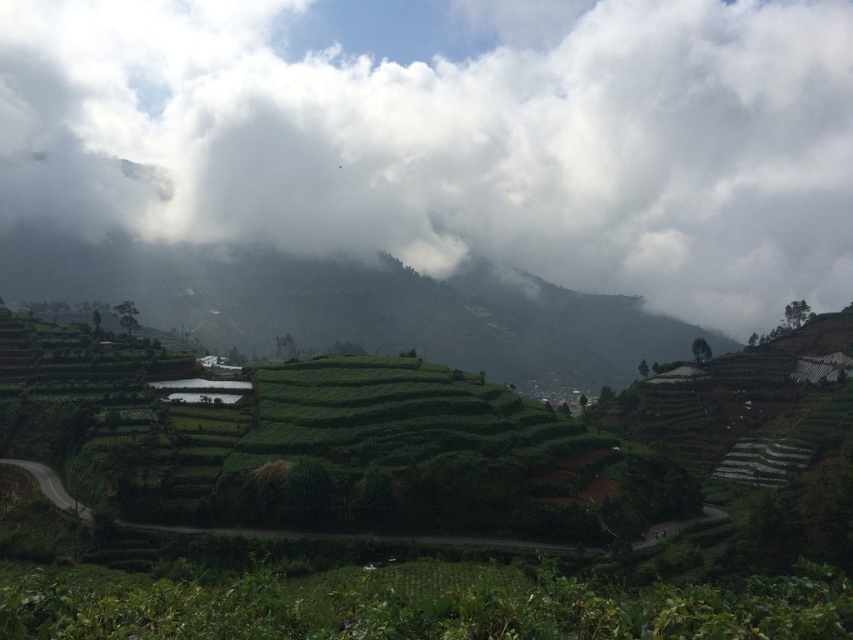
Is white fluffy cloud at upper center to the right of green grassy hillside at center from the viewer's perspective?

Correct, you'll find white fluffy cloud at upper center to the right of green grassy hillside at center.

Which is more to the right, white fluffy cloud at upper center or green grassy hillside at center?

white fluffy cloud at upper center is more to the right.

At what (x,y) coordinates should I click in order to perform the action: click on white fluffy cloud at upper center. Please return your answer as a coordinate pair (x, y). This screenshot has width=853, height=640. Looking at the image, I should click on (454, 136).